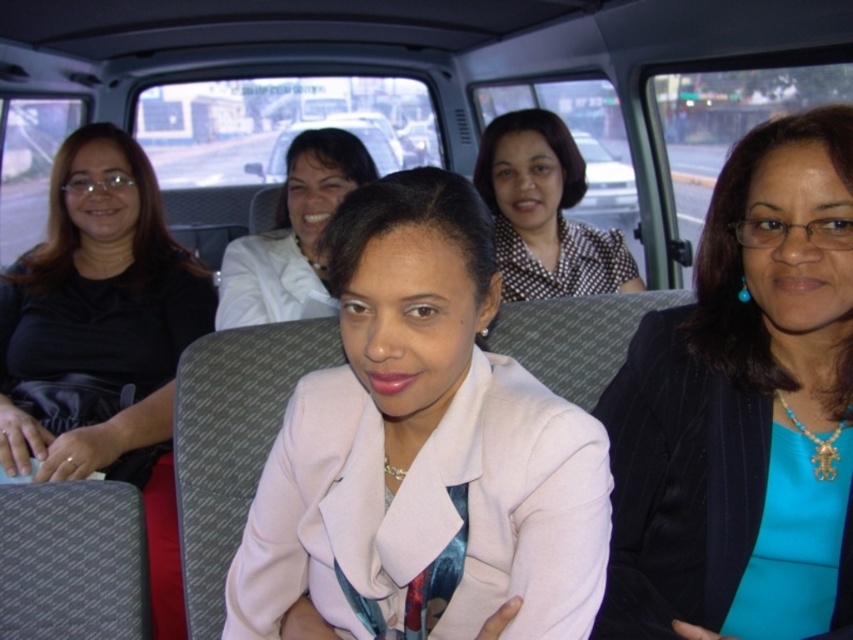
You are a photographer trying to capture a clear shot of the white matte blazer at center and the matte white car at center in the vehicle interior. Since both are white, you need to adjust your camera settings to account for their sizes. Based on the scene description, which object should you focus on first to ensure proper exposure, and why?

The white matte blazer at center is much taller than the matte white car at center. Therefore, you should focus on the white matte blazer at center first because its larger size will require more careful exposure adjustment to avoid overexposure compared to the smaller matte white car at center.

You are a tailor measuring clothing items in a store. You have two items in front of you, the white matte blazer at center and the matte white jacket at center. Which one is taller?

The white matte blazer at center is taller than the matte white jacket at center.

You are a passenger in the vehicle and need to place a rectangular box that is 1 meter wide on the seat next to you. The box must fit entirely within the space between the white matte blazer at center and the matte white car at center. Can the box fit?

The white matte blazer at center has a lesser width compared to matte white car at center. Since the box is 1 meter wide, but the space between them is narrower than the car, it might not fit. However, the exact dimensions aren